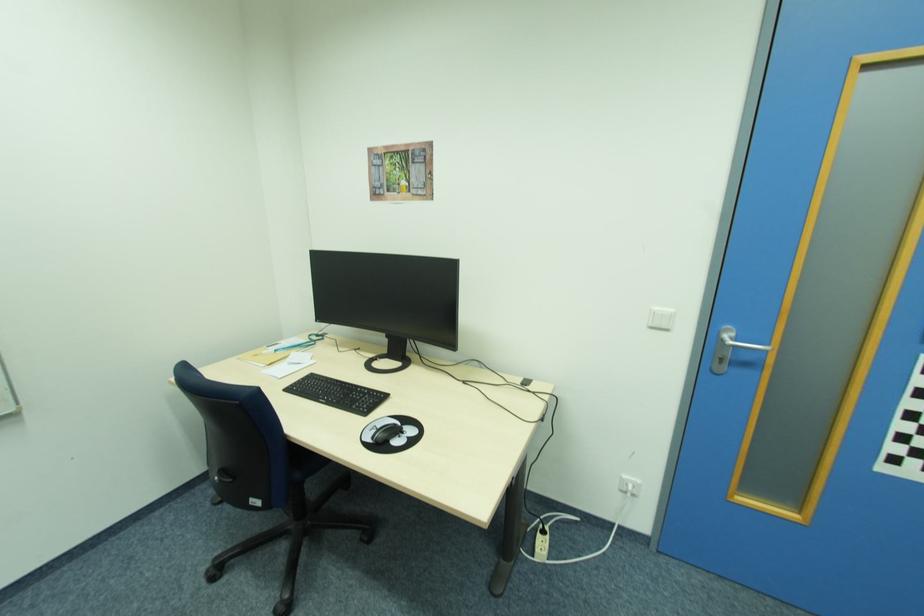
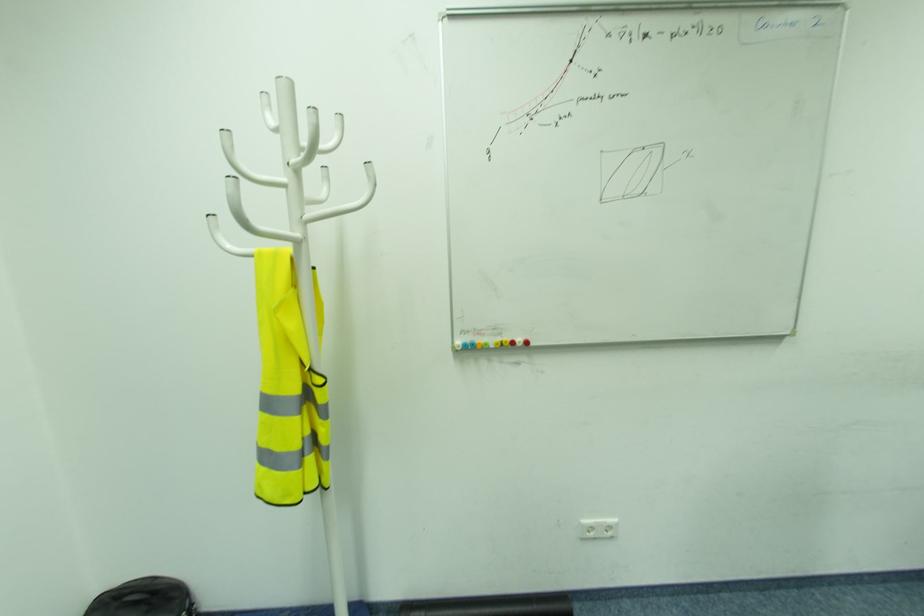
The first image is from the beginning of the video and the second image is from the end. How did the camera likely rotate when shooting the video?

The camera's rotation is toward right-down.